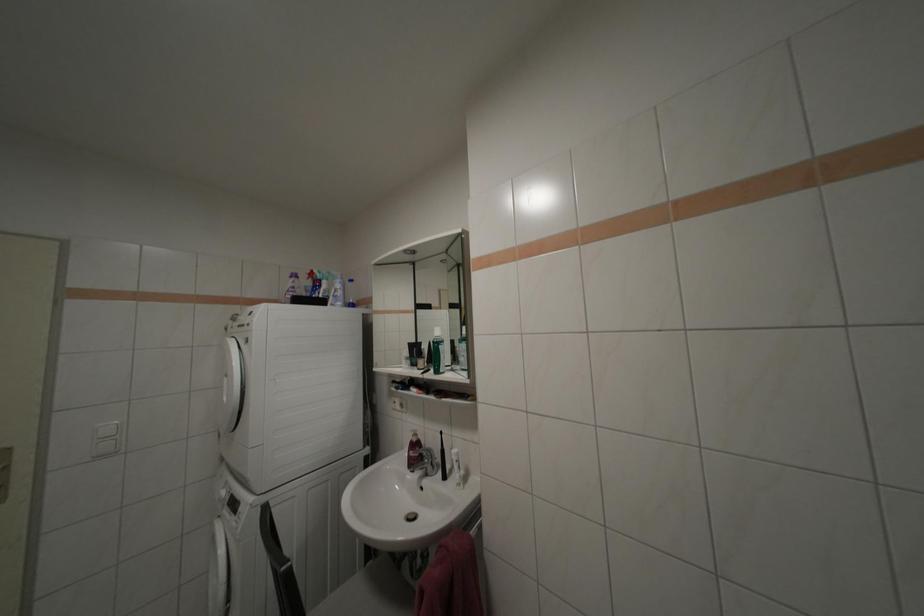
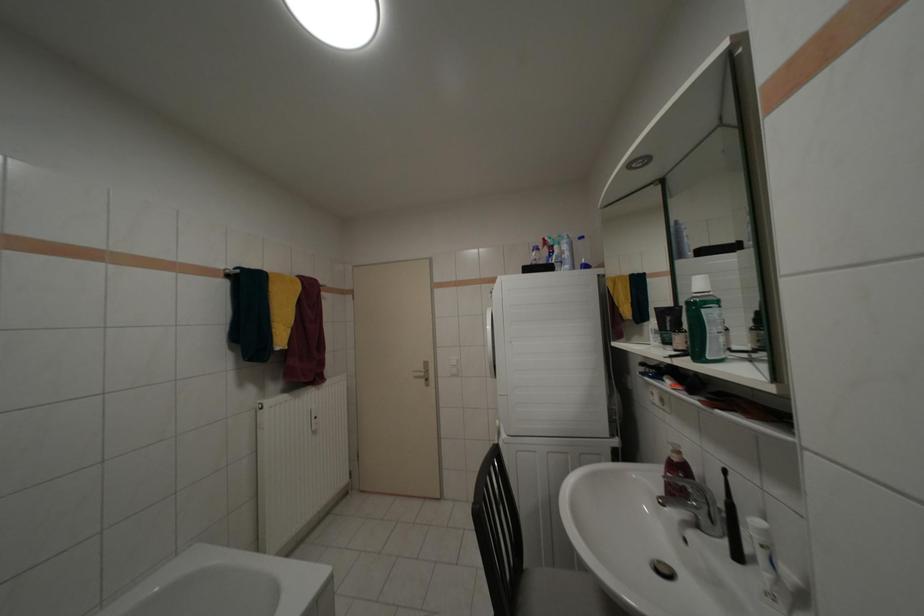
Question: The images are taken continuously from a first-person perspective. In which direction is your viewpoint rotating?

Choices:
 (A) Left
 (B) Right
 (C) Up
 (D) Down

Answer: (A)